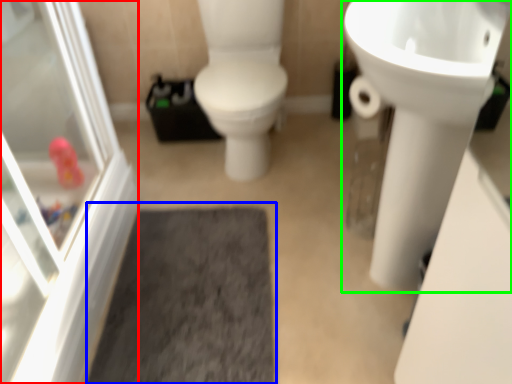
Question: Based on their relative distances, which object is nearer to screen door (highlighted by a red box)? Choose from bath mat (highlighted by a blue box) and sink (highlighted by a green box).

Choices:
 (A) bath mat
 (B) sink

Answer: (A)